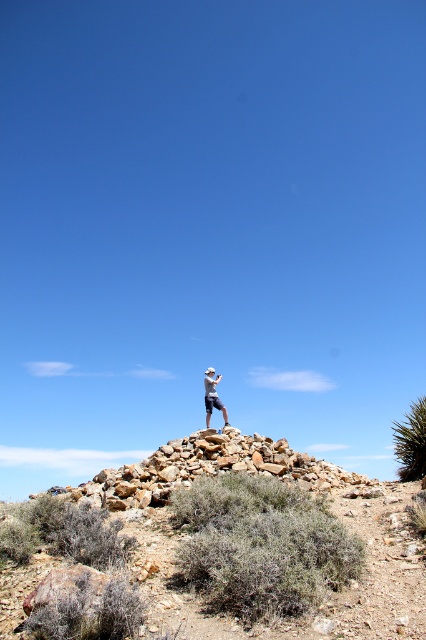
Question: Can you confirm if rockyroughrocky at center is bigger than light blue denim shorts at center?

Choices:
 (A) no
 (B) yes

Answer: (B)

Question: Is rockyroughrocky at center to the left of light blue denim shorts at center from the viewer's perspective?

Choices:
 (A) no
 (B) yes

Answer: (B)

Question: Is rockyroughrocky at center smaller than light blue denim shorts at center?

Choices:
 (A) yes
 (B) no

Answer: (B)

Question: Which of the following is the farthest from the observer?

Choices:
 (A) (224, 413)
 (B) (293, 468)

Answer: (A)